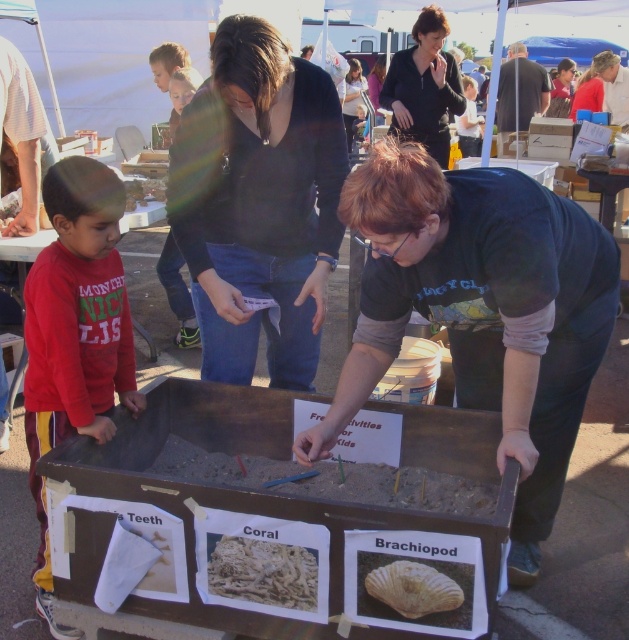
Question: Can you confirm if matte black shirt at center is positioned below smooth skin face at upper center?

Choices:
 (A) yes
 (B) no

Answer: (B)

Question: Which point is closer to the camera taking this photo?

Choices:
 (A) click(621, 113)
 (B) click(226, 134)
 (C) click(508, 97)

Answer: (B)

Question: Which point is closer to the camera?

Choices:
 (A) (70, 166)
 (B) (521, 56)

Answer: (A)

Question: Which point appears closest to the camera in this image?

Choices:
 (A) coord(404,589)
 (B) coord(276,595)

Answer: (A)

Question: Can you confirm if dark blue shirt at center is positioned above matte black shirt at center?

Choices:
 (A) yes
 (B) no

Answer: (B)

Question: Is black matte sweater at upper center to the left of matte black shirt at center from the viewer's perspective?

Choices:
 (A) yes
 (B) no

Answer: (A)